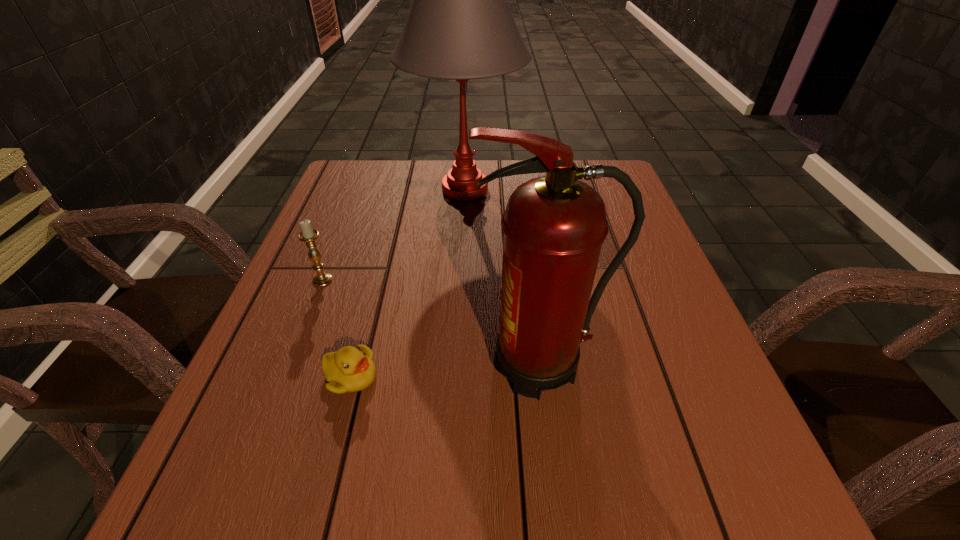
Locate an element on the screen. The image size is (960, 540). free spot between the duckling and the fire extinguisher is located at coordinates click(445, 370).

The width and height of the screenshot is (960, 540). I want to click on vacant space in between the third shortest object and the leftmost object, so click(432, 322).

Find the location of a particular element. The height and width of the screenshot is (540, 960). free space that is in between the shortest object and the third shortest object is located at coordinates (445, 370).

Find the location of `vacant point located between the third tallest object and the duckling`. vacant point located between the third tallest object and the duckling is located at coordinates pos(336,328).

Locate an element on the screen. free space between the second shortest object and the table lamp is located at coordinates (394, 235).

I want to click on vacant region between the fire extinguisher and the third tallest object, so click(432, 322).

Image resolution: width=960 pixels, height=540 pixels. Find the location of `vacant space that's between the leftmost object and the farthest object`. vacant space that's between the leftmost object and the farthest object is located at coordinates [394, 235].

Identify which object is the second closest to the second tallest object. Please provide its 2D coordinates. Your answer should be formatted as a tuple, i.e. [(x, y)], where the tuple contains the x and y coordinates of a point satisfying the conditions above.

[(308, 235)]

Identify which object is the third closest to the duckling. Please provide its 2D coordinates. Your answer should be formatted as a tuple, i.e. [(x, y)], where the tuple contains the x and y coordinates of a point satisfying the conditions above.

[(459, 27)]